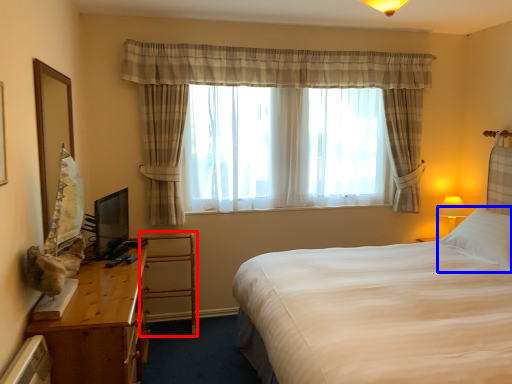
Question: Which object appears farthest to the camera in this image, armchair (highlighted by a red box) or pillow (highlighted by a blue box)?

Choices:
 (A) armchair
 (B) pillow

Answer: (A)